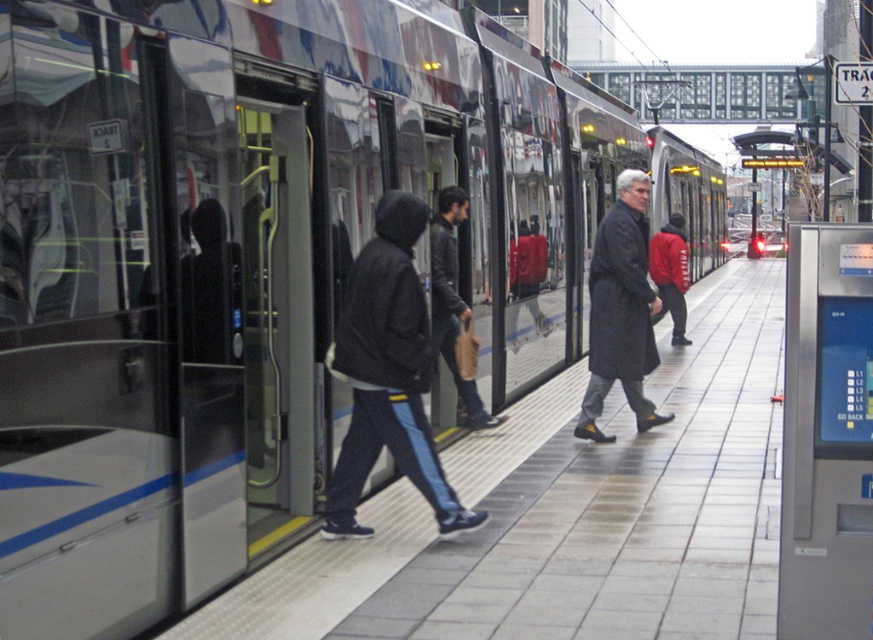
Looking at this image, who is shorter, dark blue jeans at center or red fleece jacket at center?

red fleece jacket at center is shorter.

Measure the distance between dark blue jeans at center and red fleece jacket at center.

The distance of dark blue jeans at center from red fleece jacket at center is 8.46 meters.

Looking at this image, measure the distance between dark blue jeans at center and camera.

dark blue jeans at center is 4.96 meters from camera.

Find the location of a particular element. This screenshot has height=640, width=873. dark blue jeans at center is located at coordinates (387, 372).

Can you confirm if dark blue jeans at center is wider than dark gray coat at center?

No.

Does dark blue jeans at center appear on the left side of dark gray coat at center?

Yes, dark blue jeans at center is to the left of dark gray coat at center.

I want to click on dark blue jeans at center, so click(387, 372).

The width and height of the screenshot is (873, 640). Identify the location of dark blue jeans at center. (387, 372).

Does leather jacket at center lie behind red fleece jacket at center?

No, leather jacket at center is in front of red fleece jacket at center.

What do you see at coordinates (452, 300) in the screenshot? The image size is (873, 640). I see `leather jacket at center` at bounding box center [452, 300].

This screenshot has width=873, height=640. Identify the location of leather jacket at center. (452, 300).